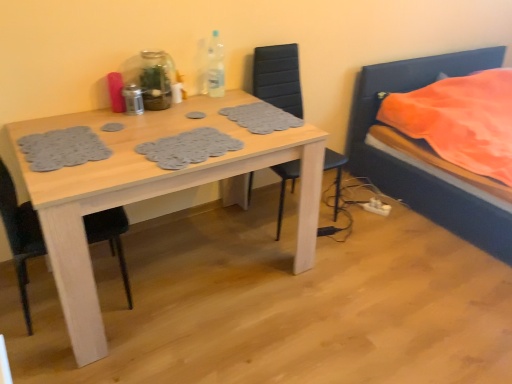
Question: Would you say transparent glass bottle at upper center, which ranks as the 2th bottle in left-to-right order, is a long distance from black leather chair at center, which ranks as the first chair in right-to-left order?

Choices:
 (A) yes
 (B) no

Answer: (B)

Question: From the image's perspective, is transparent glass bottle at upper center, which ranks as the 2th bottle in left-to-right order, over black leather chair at center, marked as the 2th chair in a left-to-right arrangement?

Choices:
 (A) yes
 (B) no

Answer: (A)

Question: Can you confirm if transparent glass bottle at upper center, which ranks as the 2th bottle in left-to-right order, is bigger than black leather chair at center, which ranks as the first chair in right-to-left order?

Choices:
 (A) no
 (B) yes

Answer: (A)

Question: Does transparent glass bottle at upper center, which ranks as the 2th bottle in right-to-left order, appear on the right side of black leather chair at center, marked as the 2th chair in a left-to-right arrangement?

Choices:
 (A) no
 (B) yes

Answer: (A)

Question: Does transparent glass bottle at upper center, which ranks as the 2th bottle in left-to-right order, lie behind black leather chair at center, marked as the 2th chair in a left-to-right arrangement?

Choices:
 (A) yes
 (B) no

Answer: (A)

Question: Is transparent glass bottle at upper center, which ranks as the 2th bottle in right-to-left order, surrounding black leather chair at center, marked as the 2th chair in a left-to-right arrangement?

Choices:
 (A) no
 (B) yes

Answer: (A)

Question: Can you confirm if light wood table at center is bigger than clear plastic bottle at upper center, the first bottle positioned from the right?

Choices:
 (A) yes
 (B) no

Answer: (A)

Question: From the image's perspective, would you say light wood table at center is positioned over clear plastic bottle at upper center, the first bottle positioned from the right?

Choices:
 (A) no
 (B) yes

Answer: (A)

Question: Are light wood table at center and clear plastic bottle at upper center, the first bottle positioned from the right, far apart?

Choices:
 (A) no
 (B) yes

Answer: (A)

Question: Does light wood table at center appear on the left side of clear plastic bottle at upper center, the first bottle positioned from the right?

Choices:
 (A) no
 (B) yes

Answer: (B)

Question: From a real-world perspective, does light wood table at center stand above clear plastic bottle at upper center, the first bottle positioned from the right?

Choices:
 (A) no
 (B) yes

Answer: (A)

Question: From a real-world perspective, is light wood table at center beneath clear plastic bottle at upper center, which is the third bottle from left to right?

Choices:
 (A) no
 (B) yes

Answer: (B)

Question: Can we say white plastic power plugs and sockets at lower right lies outside black matte chair at left, which appears as the second chair when viewed from the right?

Choices:
 (A) no
 (B) yes

Answer: (B)